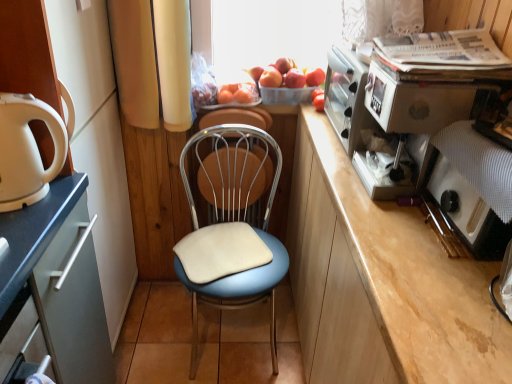
Question: In the image, is red matte apple at upper center, placed as the second apple when sorted from left to right, positioned in front of or behind metallic silver coffee machine at upper right?

Choices:
 (A) front
 (B) behind

Answer: (B)

Question: Would you say red matte apple at upper center, placed as the second apple when sorted from left to right, is to the left or to the right of metallic silver coffee machine at upper right in the picture?

Choices:
 (A) left
 (B) right

Answer: (A)

Question: Which of these objects is positioned closest to the metallic blue chair at center?

Choices:
 (A) red matte apple at upper center, placed as the second apple when sorted from left to right
 (B) blue fabric-covered chair at center
 (C) smooth red apple at center, which is counted as the 2th apple, starting from the right
 (D) matte white cabinet at left
 (E) orange matte plastic basket at upper center

Answer: (E)

Question: Which object is the closest to the orange matte plastic basket at upper center?

Choices:
 (A) metallic silver coffee machine at upper right
 (B) smooth red apple at center, which is counted as the 2th apple, starting from the right
 (C) metallic blue chair at center
 (D) blue fabric-covered chair at center
 (E) red matte apple at upper center, placed as the second apple when sorted from left to right

Answer: (B)